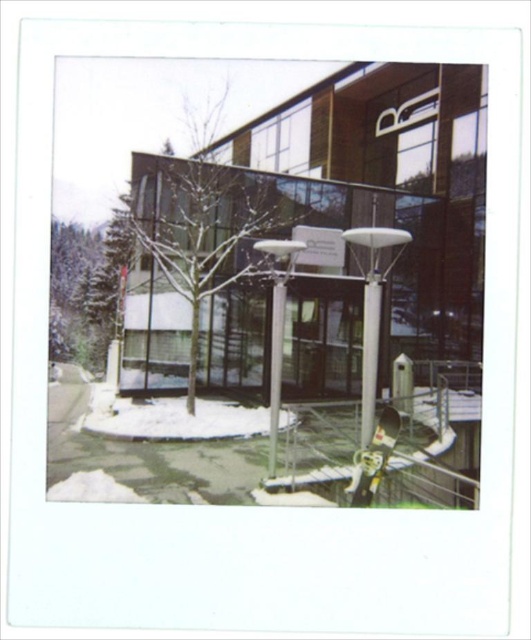
You are standing at the entrance of the modern building and want to walk towards the green textured tree at left. Which direction should you face to walk directly towards it?

The green textured tree at left is located at point 0.459 on the x axis and 0.139 on the y axis. Since the entrance is at the center of the image, you should face towards the left to walk directly towards the green textured tree at left.

You are a city planner assessing the area in front of the modern building. You need to install a new security camera that requires a mounting height of at least 3 meters. Given the green textured tree at left and the silver metallic lamp post at center, which object would be suitable for mounting the camera?

The green textured tree at left is much taller than the silver metallic lamp post at center, so the camera should be mounted on the green textured tree at left to achieve the required height of 3 meters.